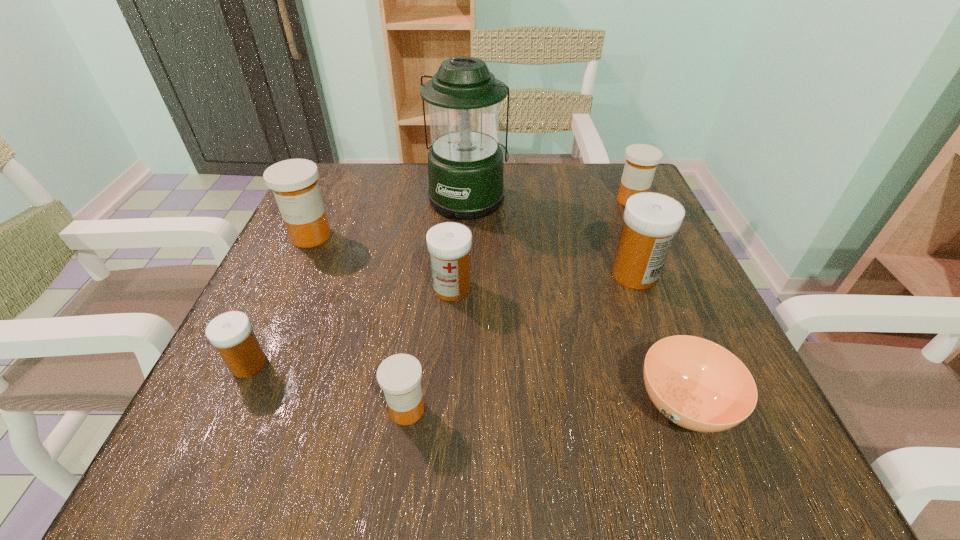
At what (x,y) coordinates should I click in order to perform the action: click on free region located on the right of the second white medicine from right to left. Please return your answer as a coordinate pair (x, y). The height and width of the screenshot is (540, 960). Looking at the image, I should click on (672, 288).

Locate an element on the screen. vacant position located 0.190m on the right of the leftmost white medicine is located at coordinates (392, 364).

Identify the location of vacant space situated 0.240m on the back of the peach soup bowl. (630, 261).

You are a GUI agent. You are given a task and a screenshot of the screen. Output one action in this format:
    pyautogui.click(x=<x>, y=<y>)
    Task: Click on the lantern that is at the far edge
    The width and height of the screenshot is (960, 540).
    Given the screenshot: What is the action you would take?
    coord(465,163)

Find the location of a particular element. The height and width of the screenshot is (540, 960). medicine that is at the far edge is located at coordinates (641, 162).

Find the location of a particular element. medicine located at the near edge is located at coordinates (399, 376).

This screenshot has height=540, width=960. In order to click on soup bowl that is positioned at the near edge in this screenshot , I will do `click(697, 384)`.

This screenshot has width=960, height=540. In order to click on soup bowl that is at the right edge in this screenshot , I will do `click(697, 384)`.

Locate an element on the screen. This screenshot has height=540, width=960. object present at the far right corner is located at coordinates (641, 162).

This screenshot has width=960, height=540. In order to click on object located in the near right corner section of the desktop in this screenshot , I will do `click(697, 384)`.